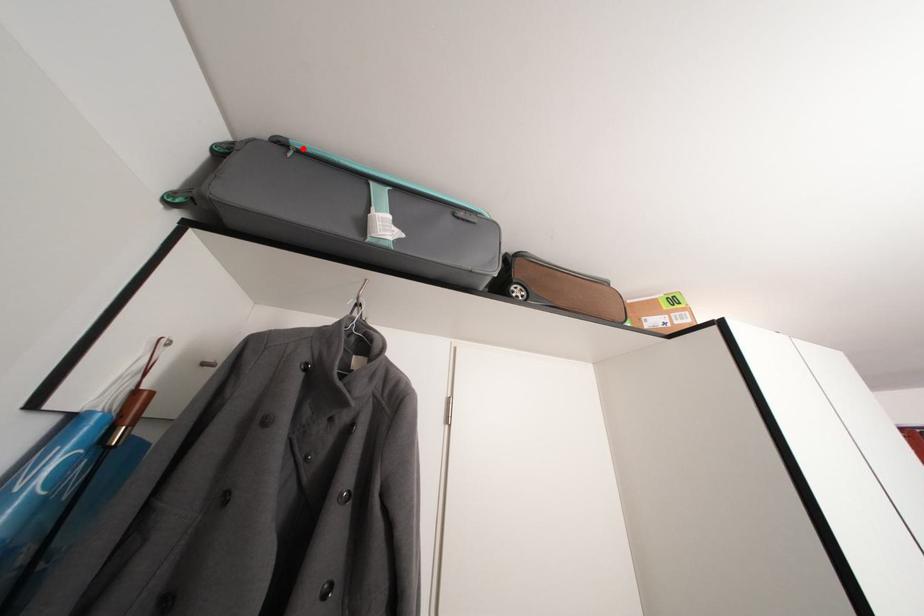
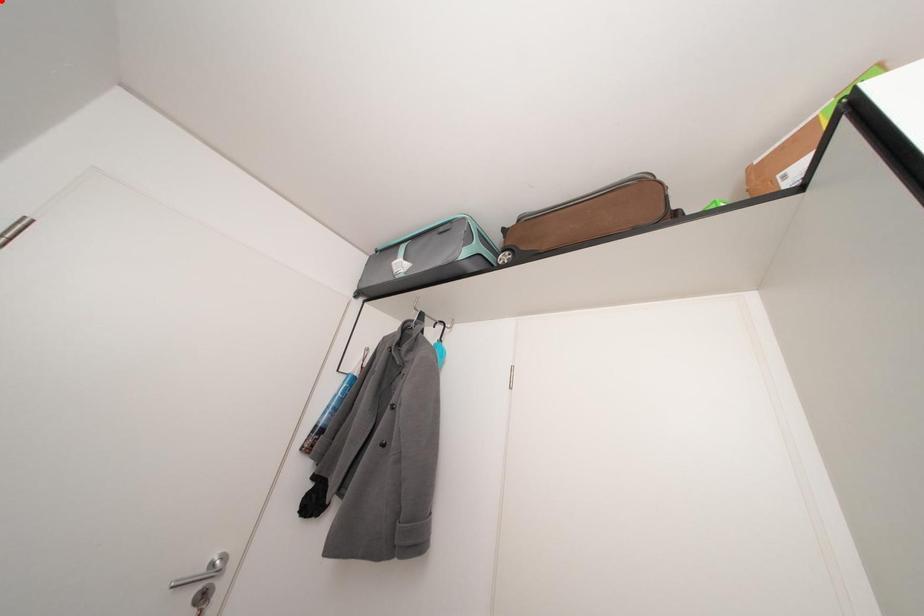
I am providing you with two images of the same scene from different viewpoints. A red point is marked on the first image and another point is marked on the second image. Is the marked point in image1 the same physical position as the marked point in image2?

No